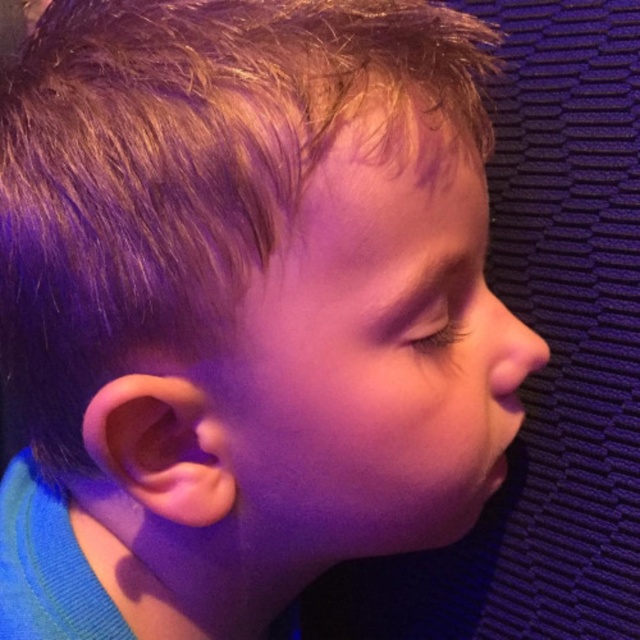
The child in the image is resting with their eyes closed. Based on the scene, can you determine if the blonde smooth hair at upper left is covering the smooth flesh nose at right?

The blonde smooth hair at upper left is positioned over the smooth flesh nose at right, so yes, the hair is covering the nose.

You are a photographer adjusting the focus on your camera. You have two points in the image you need to focus on, point (x=179, y=280) and point (x=257, y=317). Which point should you focus on first to ensure it appears sharp in the final photo?

Point (x=179, y=280) is closer to the camera than point (x=257, y=317), so you should focus on point (x=179, y=280) first to ensure it appears sharp in the final photo.

You are a photographer adjusting the lighting for a portrait. You notice the blonde smooth hair at upper left and the smooth skin face at center. Which object should you focus your spotlight on to highlight the taller one?

The blonde smooth hair at upper left is taller than the smooth skin face at center, so you should focus the spotlight on the blonde smooth hair at upper left to highlight the taller one.